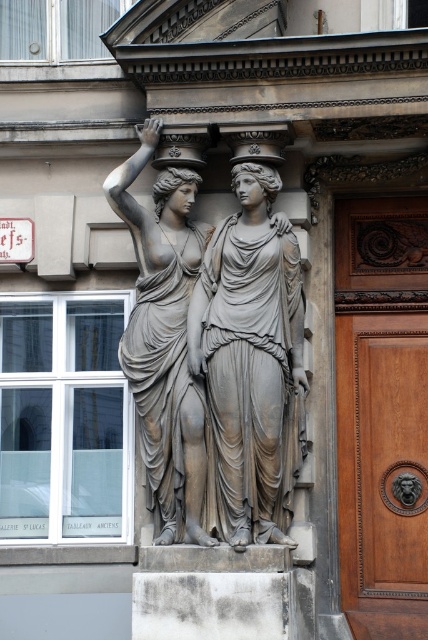
Question: Is brown polished wood door at right below gray stone statue at center?

Choices:
 (A) no
 (B) yes

Answer: (B)

Question: Which of the following is the farthest from the observer?

Choices:
 (A) gray stone statue at center
 (B) bronze statue at center
 (C) brown polished wood door at right

Answer: (C)

Question: Which object is positioned farthest from the brown polished wood door at right?

Choices:
 (A) bronze statue at center
 (B) gray stone statue at center

Answer: (A)

Question: Does brown polished wood door at right appear on the left side of gray stone statue at center?

Choices:
 (A) no
 (B) yes

Answer: (A)

Question: Which of the following is the closest to the observer?

Choices:
 (A) (155, 250)
 (B) (360, 522)

Answer: (A)

Question: Does brown polished wood door at right appear on the right side of gray stone statue at center?

Choices:
 (A) yes
 (B) no

Answer: (A)